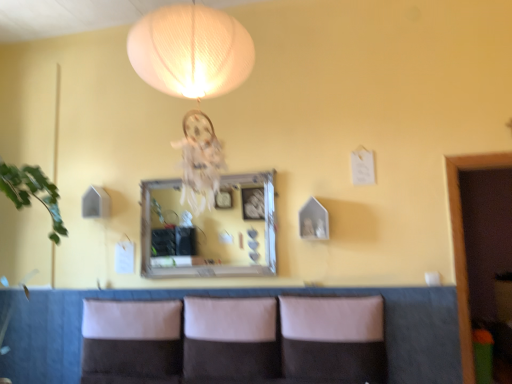
What is the approximate height of leather-like beige pillow at center, which is the 3th pillow from left to right?

leather-like beige pillow at center, which is the 3th pillow from left to right, is 20.91 inches in height.

Identify the location of leather-like beige pillow at center, which is the 3th pillow from left to right. This screenshot has height=384, width=512. (333, 339).

Locate an element on the screen. wooden-framed mirror at center is located at coordinates (209, 231).

I want to click on suede-like beige pillow at center, the 2th pillow positioned from the right, so click(230, 340).

What do you see at coordinates (385, 324) in the screenshot?
I see `leather-like brown couch at lower center` at bounding box center [385, 324].

Find the location of a particular element. This screenshot has width=512, height=384. leather-like beige pillow at center, which is the 3th pillow from left to right is located at coordinates (333, 339).

Is wooden-framed mirror at center situated inside leather-like beige pillow at center, which is the 3th pillow from left to right, or outside?

wooden-framed mirror at center is outside leather-like beige pillow at center, which is the 3th pillow from left to right.

Would you consider wooden-framed mirror at center to be distant from leather-like beige pillow at center, which is the 3th pillow from left to right?

No, wooden-framed mirror at center is in close proximity to leather-like beige pillow at center, which is the 3th pillow from left to right.

Considering the sizes of wooden-framed mirror at center and leather-like beige pillow at center, which is the 3th pillow from left to right, in the image, is wooden-framed mirror at center bigger or smaller than leather-like beige pillow at center, which is the 3th pillow from left to right,?

Considering their sizes, wooden-framed mirror at center takes up less space than leather-like beige pillow at center, which is the 3th pillow from left to right.

Could you tell me if wooden-framed mirror at center is facing leather-like beige pillow at center, which is the 3th pillow from left to right?

No, wooden-framed mirror at center is not turned towards leather-like beige pillow at center, which is the 3th pillow from left to right.

Considering the relative sizes of leather-like beige pillow at center, the 1th pillow from the right, and white fabric pillow at lower center, which is counted as the 3th pillow, starting from the right, in the image provided, is leather-like beige pillow at center, the 1th pillow from the right, smaller than white fabric pillow at lower center, which is counted as the 3th pillow, starting from the right,?

Actually, leather-like beige pillow at center, the 1th pillow from the right, might be larger than white fabric pillow at lower center, which is counted as the 3th pillow, starting from the right.

From the image's perspective, does leather-like beige pillow at center, the 1th pillow from the right, appear higher than white fabric pillow at lower center, which is counted as the 3th pillow, starting from the right?

Yes, from the image's perspective, leather-like beige pillow at center, the 1th pillow from the right, is above white fabric pillow at lower center, which is counted as the 3th pillow, starting from the right.

You are a GUI agent. You are given a task and a screenshot of the screen. Output one action in this format:
    pyautogui.click(x=<x>, y=<y>)
    Task: Click on the pillow that is the 2nd object located above the white fabric pillow at lower center, which is counted as the 3th pillow, starting from the right (from the image's perspective)
    
    Given the screenshot: What is the action you would take?
    pyautogui.click(x=333, y=339)

Is leather-like beige pillow at center, the 1th pillow from the right, not close to white fabric pillow at lower center, which is the first pillow in left-to-right order?

Absolutely, leather-like beige pillow at center, the 1th pillow from the right, is distant from white fabric pillow at lower center, which is the first pillow in left-to-right order.

Is leather-like beige pillow at center, the 1th pillow from the right, in front of or behind suede-like beige pillow at center, the 2th pillow positioned from the right, in the image?

Visually, leather-like beige pillow at center, the 1th pillow from the right, is located in front of suede-like beige pillow at center, the 2th pillow positioned from the right.

Which of these two, leather-like beige pillow at center, which is the 3th pillow from left to right, or suede-like beige pillow at center, which appears as the second pillow when viewed from the left, is smaller?

suede-like beige pillow at center, which appears as the second pillow when viewed from the left.

Can you confirm if leather-like beige pillow at center, which is the 3th pillow from left to right, is positioned to the left of suede-like beige pillow at center, the 2th pillow positioned from the right?

A: Incorrect, leather-like beige pillow at center, which is the 3th pillow from left to right, is not on the left side of suede-like beige pillow at center, the 2th pillow positioned from the right.

Is suede-like beige pillow at center, the 2th pillow positioned from the right, surrounded by leather-like beige pillow at center, which is the 3th pillow from left to right?

No, suede-like beige pillow at center, the 2th pillow positioned from the right, is not inside leather-like beige pillow at center, which is the 3th pillow from left to right.

From the image's perspective, between white fabric pillow at lower center, which is the first pillow in left-to-right order, and wooden-framed mirror at center, who is located below?

white fabric pillow at lower center, which is the first pillow in left-to-right order, appears lower in the image.

Consider the image. Is white fabric pillow at lower center, which is counted as the 3th pillow, starting from the right, turned away from wooden-framed mirror at center?

No, wooden-framed mirror at center is not at the back of white fabric pillow at lower center, which is counted as the 3th pillow, starting from the right.

Looking at the image, does white fabric pillow at lower center, which is counted as the 3th pillow, starting from the right, seem bigger or smaller compared to wooden-framed mirror at center?

Clearly, white fabric pillow at lower center, which is counted as the 3th pillow, starting from the right, is larger in size than wooden-framed mirror at center.

The image size is (512, 384). Find the location of `the 3rd pillow positioned below the wooden-framed mirror at center (from the image's perspective)`. the 3rd pillow positioned below the wooden-framed mirror at center (from the image's perspective) is located at coordinates (131, 342).

What's the angular difference between white fabric pillow at lower center, which is counted as the 3th pillow, starting from the right, and suede-like beige pillow at center, the 2th pillow positioned from the right,'s facing directions?

The angular difference between white fabric pillow at lower center, which is counted as the 3th pillow, starting from the right, and suede-like beige pillow at center, the 2th pillow positioned from the right, is 0.000309 degrees.

Is the depth of white fabric pillow at lower center, which is the first pillow in left-to-right order, less than that of suede-like beige pillow at center, the 2th pillow positioned from the right?

No.

Is white fabric pillow at lower center, which is counted as the 3th pillow, starting from the right, in contact with suede-like beige pillow at center, the 2th pillow positioned from the right?

white fabric pillow at lower center, which is counted as the 3th pillow, starting from the right, and suede-like beige pillow at center, the 2th pillow positioned from the right, are clearly separated.

Is white fabric pillow at lower center, which is the first pillow in left-to-right order, facing towards suede-like beige pillow at center, the 2th pillow positioned from the right?

No.

Is suede-like beige pillow at center, which appears as the second pillow when viewed from the left, oriented towards leather-like beige pillow at center, which is the 3th pillow from left to right?

No, suede-like beige pillow at center, which appears as the second pillow when viewed from the left, does not turn towards leather-like beige pillow at center, which is the 3th pillow from left to right.

Considering the sizes of objects suede-like beige pillow at center, which appears as the second pillow when viewed from the left, and leather-like beige pillow at center, the 1th pillow from the right, in the image provided, who is thinner, suede-like beige pillow at center, which appears as the second pillow when viewed from the left, or leather-like beige pillow at center, the 1th pillow from the right,?

suede-like beige pillow at center, which appears as the second pillow when viewed from the left.

Considering the sizes of objects suede-like beige pillow at center, which appears as the second pillow when viewed from the left, and leather-like beige pillow at center, the 1th pillow from the right, in the image provided, who is taller, suede-like beige pillow at center, which appears as the second pillow when viewed from the left, or leather-like beige pillow at center, the 1th pillow from the right,?

Standing taller between the two is suede-like beige pillow at center, which appears as the second pillow when viewed from the left.

From the image's perspective, is suede-like beige pillow at center, which appears as the second pillow when viewed from the left, positioned above or below leather-like beige pillow at center, which is the 3th pillow from left to right?

suede-like beige pillow at center, which appears as the second pillow when viewed from the left, is below leather-like beige pillow at center, which is the 3th pillow from left to right.

From the image's perspective, is leather-like brown couch at lower center on white fabric pillow at lower center, which is the first pillow in left-to-right order?

No, from the image's perspective, leather-like brown couch at lower center is not above white fabric pillow at lower center, which is the first pillow in left-to-right order.

In the scene shown: Between leather-like brown couch at lower center and white fabric pillow at lower center, which is the first pillow in left-to-right order, which one is positioned behind?

white fabric pillow at lower center, which is the first pillow in left-to-right order, is behind.

Which object is thinner, leather-like brown couch at lower center or white fabric pillow at lower center, which is counted as the 3th pillow, starting from the right?

leather-like brown couch at lower center is thinner.

Considering the points (388, 293) and (145, 364), which point is behind, point (388, 293) or point (145, 364)?

The point (145, 364) is farther from the camera.

Locate an element on the screen. This screenshot has height=384, width=512. mirror above the leather-like beige pillow at center, which is the 3th pillow from left to right (from the image's perspective) is located at coordinates (209, 231).

There is a leather-like beige pillow at center, the 1th pillow from the right. At what (x,y) coordinates should I click in order to perform the action: click on the 2nd pillow below it (from the image's perspective). Please return your answer as a coordinate pair (x, y). Looking at the image, I should click on (131, 342).

Looking at the image, which one is located further to leather-like beige pillow at center, the 1th pillow from the right, leather-like brown couch at lower center or white fabric pillow at lower center, which is counted as the 3th pillow, starting from the right?

white fabric pillow at lower center, which is counted as the 3th pillow, starting from the right, is positioned further to the anchor leather-like beige pillow at center, the 1th pillow from the right.

Estimate the real-world distances between objects in this image. Which object is further from wooden-framed mirror at center, suede-like beige pillow at center, the 2th pillow positioned from the right, or leather-like brown couch at lower center?

Based on the image, leather-like brown couch at lower center appears to be further to wooden-framed mirror at center.

Which object lies nearer to the anchor point leather-like beige pillow at center, which is the 3th pillow from left to right, wooden-framed mirror at center or suede-like beige pillow at center, which appears as the second pillow when viewed from the left?

suede-like beige pillow at center, which appears as the second pillow when viewed from the left, is positioned closer to the anchor leather-like beige pillow at center, which is the 3th pillow from left to right.

Estimate the real-world distances between objects in this image. Which object is further from leather-like beige pillow at center, the 1th pillow from the right, wooden-framed mirror at center or leather-like brown couch at lower center?

wooden-framed mirror at center.

Looking at the image, which one is located closer to leather-like brown couch at lower center, suede-like beige pillow at center, which appears as the second pillow when viewed from the left, or white fabric pillow at lower center, which is counted as the 3th pillow, starting from the right?

Among the two, suede-like beige pillow at center, which appears as the second pillow when viewed from the left, is located nearer to leather-like brown couch at lower center.

When comparing their distances from white fabric pillow at lower center, which is counted as the 3th pillow, starting from the right, does suede-like beige pillow at center, the 2th pillow positioned from the right, or leather-like brown couch at lower center seem closer?

suede-like beige pillow at center, the 2th pillow positioned from the right.

Considering their positions, is white fabric pillow at lower center, which is counted as the 3th pillow, starting from the right, positioned further to suede-like beige pillow at center, which appears as the second pillow when viewed from the left, than wooden-framed mirror at center?

Among the two, wooden-framed mirror at center is located further to suede-like beige pillow at center, which appears as the second pillow when viewed from the left.

Considering their positions, is leather-like beige pillow at center, the 1th pillow from the right, positioned closer to white fabric pillow at lower center, which is counted as the 3th pillow, starting from the right, than wooden-framed mirror at center?

Among the two, wooden-framed mirror at center is located nearer to white fabric pillow at lower center, which is counted as the 3th pillow, starting from the right.

In order to click on couch between suede-like beige pillow at center, the 2th pillow positioned from the right, and leather-like beige pillow at center, which is the 3th pillow from left to right, in the horizontal direction in this screenshot , I will do `click(385, 324)`.

At what (x,y) coordinates should I click in order to perform the action: click on couch between wooden-framed mirror at center and leather-like beige pillow at center, which is the 3th pillow from left to right. Please return your answer as a coordinate pair (x, y). The image size is (512, 384). Looking at the image, I should click on (385, 324).

The image size is (512, 384). Find the location of `pillow between white fabric pillow at lower center, which is counted as the 3th pillow, starting from the right, and leather-like brown couch at lower center`. pillow between white fabric pillow at lower center, which is counted as the 3th pillow, starting from the right, and leather-like brown couch at lower center is located at coordinates (230, 340).

This screenshot has width=512, height=384. I want to click on pillow located between wooden-framed mirror at center and leather-like beige pillow at center, which is the 3th pillow from left to right, in the left-right direction, so click(x=230, y=340).